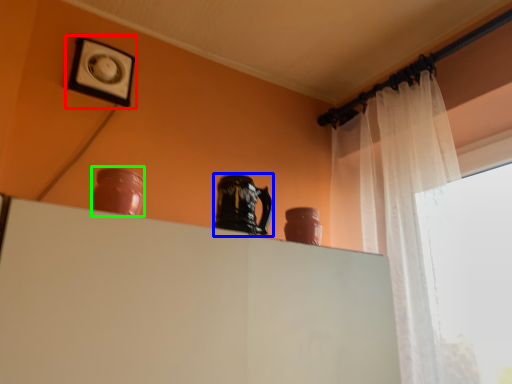
Question: Considering the real-world distances, which object is closest to picture frame (highlighted by a red box)? pottery (highlighted by a blue box) or vase (highlighted by a green box).

Choices:
 (A) pottery
 (B) vase

Answer: (B)